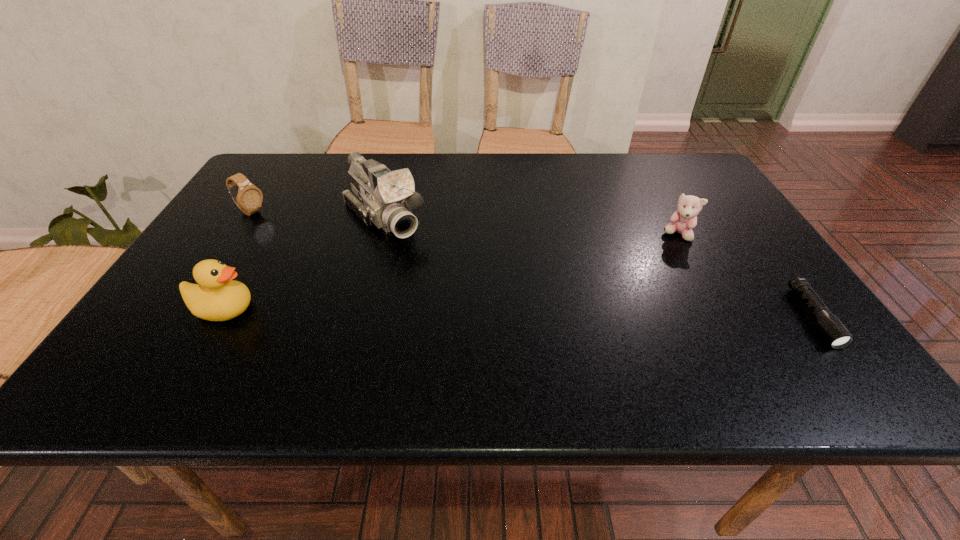
Find the location of `the fourth shortest object`. the fourth shortest object is located at coordinates (217, 297).

This screenshot has height=540, width=960. I want to click on flashlight, so click(835, 333).

This screenshot has height=540, width=960. I want to click on the rightmost object, so click(835, 333).

Find the location of a particular element. This screenshot has width=960, height=540. watch is located at coordinates (248, 198).

Find the location of `the fourth object from left to right`. the fourth object from left to right is located at coordinates (683, 220).

Where is `the third object from right to left`? The width and height of the screenshot is (960, 540). the third object from right to left is located at coordinates (385, 198).

You are a GUI agent. You are given a task and a screenshot of the screen. Output one action in this format:
    pyautogui.click(x=<x>, y=<y>)
    Task: Click on the camcorder
    The height and width of the screenshot is (540, 960).
    Given the screenshot: What is the action you would take?
    pyautogui.click(x=385, y=198)

Image resolution: width=960 pixels, height=540 pixels. What are the coordinates of `free space located at the beak of the duck` in the screenshot? It's located at (433, 309).

Identify the location of free location located on the face of the watch. This screenshot has height=540, width=960. (343, 261).

Identify the location of vacant space located on the face of the watch. (331, 255).